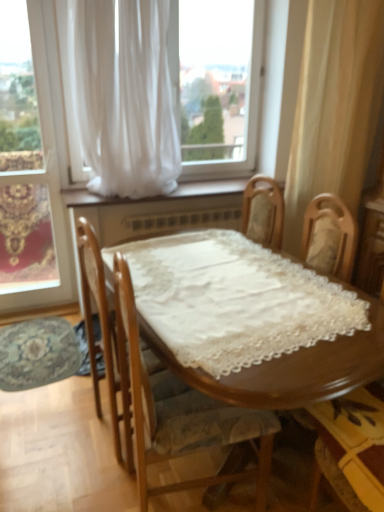
Question: Is white sheer curtain at upper center, the 2th curtain positioned from the right, wider than wooden chair at lower right, arranged as the 1th chair when viewed from the right?

Choices:
 (A) no
 (B) yes

Answer: (A)

Question: Is white sheer curtain at upper center, which appears as the first curtain when viewed from the left, oriented away from wooden chair at lower right, the 2th chair positioned from the left?

Choices:
 (A) no
 (B) yes

Answer: (A)

Question: Could wooden chair at lower right, arranged as the 1th chair when viewed from the right, be considered to be inside white sheer curtain at upper center, which appears as the first curtain when viewed from the left?

Choices:
 (A) yes
 (B) no

Answer: (B)

Question: Would you say white sheer curtain at upper center, which appears as the first curtain when viewed from the left, is outside wooden chair at lower right, the 2th chair positioned from the left?

Choices:
 (A) yes
 (B) no

Answer: (A)

Question: From the image's perspective, is white sheer curtain at upper center, which appears as the first curtain when viewed from the left, below wooden chair at lower right, arranged as the 1th chair when viewed from the right?

Choices:
 (A) yes
 (B) no

Answer: (B)

Question: From the image's perspective, is wooden chair at lower right, the 2th chair positioned from the left, above or below wooden chair with lace cushion at center, which ranks as the first chair in left-to-right order?

Choices:
 (A) below
 (B) above

Answer: (A)

Question: Is wooden chair at lower right, arranged as the 1th chair when viewed from the right, taller or shorter than wooden chair with lace cushion at center, which ranks as the first chair in left-to-right order?

Choices:
 (A) tall
 (B) short

Answer: (B)

Question: Is point (349, 404) positioned closer to the camera than point (135, 406)?

Choices:
 (A) farther
 (B) closer

Answer: (A)

Question: Looking at their shapes, would you say wooden chair at lower right, the 2th chair positioned from the left, is wider or thinner than wooden chair with lace cushion at center, which is the 2th chair from right to left?

Choices:
 (A) wide
 (B) thin

Answer: (B)

Question: Is white sheer curtain at upper center, which is the second window in left-to-right order, wider or thinner than wooden chair at lower right, the 2th chair positioned from the left?

Choices:
 (A) wide
 (B) thin

Answer: (B)

Question: Which is correct: white sheer curtain at upper center, which is the second window in left-to-right order, is inside wooden chair at lower right, the 2th chair positioned from the left, or outside of it?

Choices:
 (A) inside
 (B) outside

Answer: (B)

Question: Is point (51, 82) positioned closer to the camera than point (375, 404)?

Choices:
 (A) farther
 (B) closer

Answer: (A)

Question: Relative to wooden chair at lower right, the 2th chair positioned from the left, is white sheer curtain at upper center, which is the second window in left-to-right order, in front or behind?

Choices:
 (A) front
 (B) behind

Answer: (B)

Question: From the image's perspective, is wooden chair at lower right, the 2th chair positioned from the left, above or below white sheer curtain at left, positioned as the second window in right-to-left order?

Choices:
 (A) above
 (B) below

Answer: (B)

Question: Visually, is wooden chair at lower right, the 2th chair positioned from the left, positioned to the left or to the right of white sheer curtain at left, positioned as the second window in right-to-left order?

Choices:
 (A) left
 (B) right

Answer: (B)